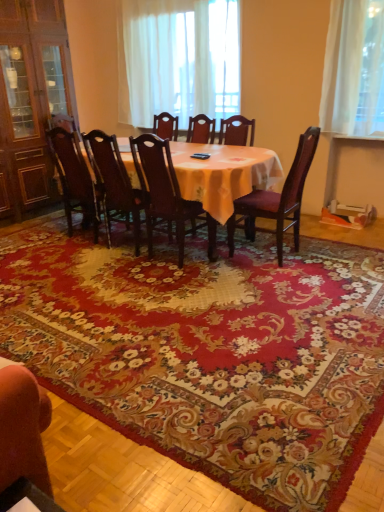
Describe the element at coordinates (166, 194) in the screenshot. I see `wooden chair at center, the third chair viewed from the right` at that location.

Identify the location of wooden chair at center, the fourth chair from the left. This screenshot has width=384, height=512. (237, 131).

Describe the element at coordinates (178, 59) in the screenshot. This screenshot has height=512, width=384. I see `white sheer curtain at upper center` at that location.

What is the approximate width of floral carpet at center?

floral carpet at center is 8.47 feet in width.

The height and width of the screenshot is (512, 384). Describe the element at coordinates (277, 199) in the screenshot. I see `wooden chair with purple cushion at right, placed as the 1th chair when sorted from right to left` at that location.

At what (x,y) coordinates should I click in order to perform the action: click on wooden chair at center, the third chair viewed from the right. Please return your answer as a coordinate pair (x, y). Looking at the image, I should click on (166, 194).

From the image's perspective, between wooden chair at center, arranged as the second chair when viewed from the right, and wooden table at center, which one is located above?

wooden chair at center, arranged as the second chair when viewed from the right, appears higher in the image.

Considering the relative positions of wooden chair at center, the fourth chair from the left, and wooden table at center in the image provided, is wooden chair at center, the fourth chair from the left, to the left of wooden table at center from the viewer's perspective?

In fact, wooden chair at center, the fourth chair from the left, is to the right of wooden table at center.

From the picture: Is wooden table at center located within wooden chair at center, arranged as the second chair when viewed from the right?

Definitely not — wooden table at center is not inside wooden chair at center, arranged as the second chair when viewed from the right.

Is wooden chair at center, the fourth chair from the left, in front of wooden table at center?

No.

Which object is thinner, floral carpet at center or wooden chair at center, arranged as the second chair when viewed from the right?

wooden chair at center, arranged as the second chair when viewed from the right.

Consider the image. Is floral carpet at center oriented away from wooden chair at center, arranged as the second chair when viewed from the right?

That's right, floral carpet at center is facing away from wooden chair at center, arranged as the second chair when viewed from the right.

Considering the relative sizes of floral carpet at center and wooden chair at center, arranged as the second chair when viewed from the right, in the image provided, is floral carpet at center shorter than wooden chair at center, arranged as the second chair when viewed from the right,?

Yes, floral carpet at center is shorter than wooden chair at center, arranged as the second chair when viewed from the right.

From the image's perspective, is floral carpet at center located above or below wooden chair at center, the fourth chair from the left?

floral carpet at center is below wooden chair at center, the fourth chair from the left.

From a real-world perspective, who is located lower, dark wood chair at center, the 2th chair when ordered from left to right, or wooden cabinet at left?

dark wood chair at center, the 2th chair when ordered from left to right.

In order to click on armoire on the left of dark wood chair at center, the 2th chair when ordered from left to right in this screenshot , I will do `click(31, 100)`.

Considering the positions of objects dark wood chair at center, the 2th chair when ordered from left to right, and wooden cabinet at left in the image provided, who is more to the left, dark wood chair at center, the 2th chair when ordered from left to right, or wooden cabinet at left?

wooden cabinet at left is more to the left.

Does dark wood chair at center, which is the fourth chair in right-to-left order, touch wooden cabinet at left?

No, dark wood chair at center, which is the fourth chair in right-to-left order, is not making contact with wooden cabinet at left.

From the image's perspective, is wooden chair at center, the third chair viewed from the right, beneath wooden chair at center, arranged as the second chair when viewed from the right?

Yes, from the image's perspective, wooden chair at center, the third chair viewed from the right, is below wooden chair at center, arranged as the second chair when viewed from the right.

Between point (166, 205) and point (226, 141), which one is positioned behind?

The point (226, 141) is farther from the camera.

Between wooden chair at center, the third chair from the left, and wooden chair at center, the fourth chair from the left, which one is positioned in front?

wooden chair at center, the third chair from the left, is in front.

Between wooden chair at center, the third chair from the left, and wooden chair at center, the fourth chair from the left, which one has more height?

With more height is wooden chair at center, the fourth chair from the left.

Is dark brown wood chair at center, the fifth chair positioned from the right, at the right side of wooden table at center?

No, dark brown wood chair at center, the fifth chair positioned from the right, is not to the right of wooden table at center.

Which object is further away from the camera, dark brown wood chair at center, the fifth chair positioned from the right, or wooden table at center?

dark brown wood chair at center, the fifth chair positioned from the right, is further from the camera.

Between dark brown wood chair at center, which ranks as the 1th chair in left-to-right order, and wooden table at center, which one has larger size?

With larger size is wooden table at center.

Considering the sizes of wooden cabinet at left and white sheer curtain at upper center in the image, is wooden cabinet at left bigger or smaller than white sheer curtain at upper center?

wooden cabinet at left is bigger than white sheer curtain at upper center.

What's the angular difference between wooden cabinet at left and white sheer curtain at upper center's facing directions?

The angular difference between wooden cabinet at left and white sheer curtain at upper center is 89.8 degrees.

The width and height of the screenshot is (384, 512). Identify the location of curtain above the wooden cabinet at left (from the image's perspective). pyautogui.click(x=178, y=59).

Considering the relative sizes of wooden cabinet at left and white sheer curtain at upper center in the image provided, is wooden cabinet at left thinner than white sheer curtain at upper center?

No, wooden cabinet at left is not thinner than white sheer curtain at upper center.

Is wooden chair at center, the fourth chair from the left, positioned beyond the bounds of wooden cabinet at left?

Yes, wooden chair at center, the fourth chair from the left, is located beyond the bounds of wooden cabinet at left.

Is wooden chair at center, arranged as the second chair when viewed from the right, closer to camera compared to wooden cabinet at left?

That is True.

From a real-world perspective, does wooden chair at center, arranged as the second chair when viewed from the right, stand above wooden cabinet at left?

No, from a real-world perspective, wooden chair at center, arranged as the second chair when viewed from the right, is not on top of wooden cabinet at left.

From the image's perspective, is wooden chair at center, arranged as the second chair when viewed from the right, located above or below wooden cabinet at left?

wooden chair at center, arranged as the second chair when viewed from the right, is situated lower than wooden cabinet at left in the image.

Which chair is the 2nd one when counting from the right side of the wooden table at center? Please provide its 2D coordinates.

[(237, 131)]

The height and width of the screenshot is (512, 384). Find the location of `mat that appears below the wooden chair at center, arranged as the second chair when viewed from the right (from a real-world perspective)`. mat that appears below the wooden chair at center, arranged as the second chair when viewed from the right (from a real-world perspective) is located at coordinates (198, 367).

Estimate the real-world distances between objects in this image. Which object is closer to dark brown wood chair at center, the fifth chair positioned from the right, wooden chair at center, the third chair viewed from the right, or wooden chair with purple cushion at right, placed as the 1th chair when sorted from right to left?

Based on the image, wooden chair at center, the third chair viewed from the right, appears to be nearer to dark brown wood chair at center, the fifth chair positioned from the right.

Looking at the image, which one is located closer to wooden chair with purple cushion at right, the fifth chair when ordered from left to right, wooden chair at center, the third chair from the left, or dark brown wood chair at center, which ranks as the 1th chair in left-to-right order?

Based on the image, wooden chair at center, the third chair from the left, appears to be nearer to wooden chair with purple cushion at right, the fifth chair when ordered from left to right.

From the image, which object appears to be nearer to wooden table at center, wooden chair with purple cushion at right, placed as the 1th chair when sorted from right to left, or dark brown wood chair at center, which ranks as the 1th chair in left-to-right order?

wooden chair with purple cushion at right, placed as the 1th chair when sorted from right to left, is closer to wooden table at center.

When comparing their distances from wooden cabinet at left, does white sheer curtain at upper center or wooden chair at center, the fourth chair from the left, seem further?

wooden chair at center, the fourth chair from the left, lies further to wooden cabinet at left than the other object.

Which object lies nearer to the anchor point wooden chair at center, arranged as the second chair when viewed from the right, wooden chair with purple cushion at right, the fifth chair when ordered from left to right, or wooden cabinet at left?

The object closer to wooden chair at center, arranged as the second chair when viewed from the right, is wooden chair with purple cushion at right, the fifth chair when ordered from left to right.

When comparing their distances from wooden chair at center, the fourth chair from the left, does wooden chair with purple cushion at right, placed as the 1th chair when sorted from right to left, or dark wood chair at center, the 2th chair when ordered from left to right, seem further?

dark wood chair at center, the 2th chair when ordered from left to right, is further to wooden chair at center, the fourth chair from the left.

Which object lies further to the anchor point wooden table at center, dark wood chair at center, the 2th chair when ordered from left to right, or wooden cabinet at left?

Among the two, wooden cabinet at left is located further to wooden table at center.

Estimate the real-world distances between objects in this image. Which object is closer to dark wood chair at center, which is the fourth chair in right-to-left order, wooden chair with purple cushion at right, placed as the 1th chair when sorted from right to left, or floral carpet at center?

Among the two, wooden chair with purple cushion at right, placed as the 1th chair when sorted from right to left, is located nearer to dark wood chair at center, which is the fourth chair in right-to-left order.

In order to click on kitchen & dining room table between dark wood chair at center, the 2th chair when ordered from left to right, and wooden chair at center, arranged as the second chair when viewed from the right, from left to right in this screenshot , I will do `click(241, 183)`.

Where is `chair between wooden chair at center, the third chair viewed from the right, and wooden chair with purple cushion at right, the fifth chair when ordered from left to right, from left to right`? chair between wooden chair at center, the third chair viewed from the right, and wooden chair with purple cushion at right, the fifth chair when ordered from left to right, from left to right is located at coordinates (237, 131).

Where is `kitchen & dining room table between wooden cabinet at left and wooden chair at center, arranged as the second chair when viewed from the right, in the horizontal direction`? kitchen & dining room table between wooden cabinet at left and wooden chair at center, arranged as the second chair when viewed from the right, in the horizontal direction is located at coordinates (241, 183).

Where is `kitchen & dining room table positioned between floral carpet at center and dark wood chair at center, which is the fourth chair in right-to-left order, from near to far`? This screenshot has height=512, width=384. kitchen & dining room table positioned between floral carpet at center and dark wood chair at center, which is the fourth chair in right-to-left order, from near to far is located at coordinates (241, 183).